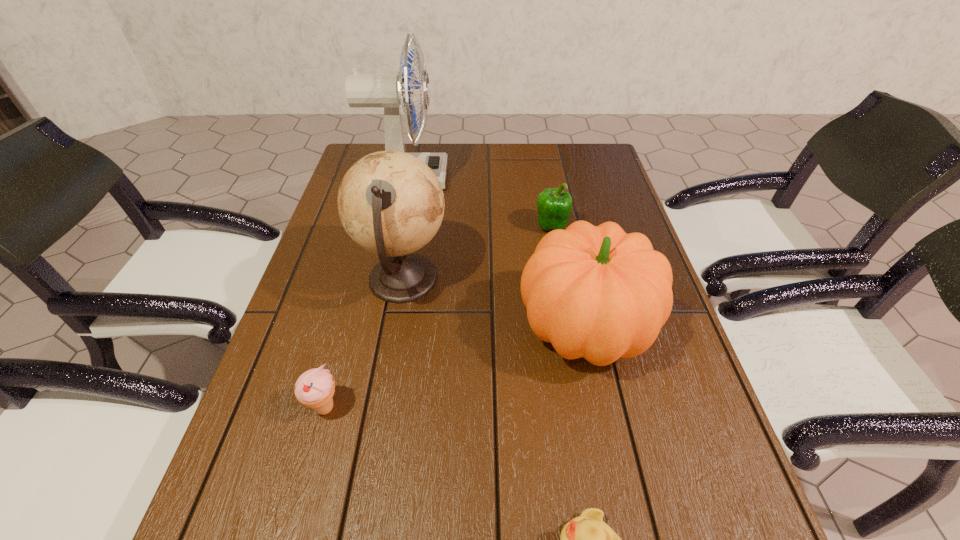
Where is `vacant space at the left edge`? The height and width of the screenshot is (540, 960). vacant space at the left edge is located at coordinates (336, 259).

Identify the location of vacant space at the right edge of the desktop. This screenshot has width=960, height=540. (586, 206).

In the image, there is a desktop. Where is `blank space at the near left corner`? blank space at the near left corner is located at coordinates (223, 535).

The image size is (960, 540). What are the coordinates of `free area in between the third tallest object and the globe` in the screenshot? It's located at (494, 305).

Identify the location of free space between the farthest object and the third tallest object. (496, 254).

Locate an element on the screen. The image size is (960, 540). vacant space in between the tallest object and the pumpkin is located at coordinates (496, 254).

Identify the location of vacant region between the pumpkin and the globe. This screenshot has height=540, width=960. (494, 305).

Locate an element on the screen. blank region between the icecream and the tallest object is located at coordinates (366, 293).

Where is `vacant space in between the fan and the second shortest object`? vacant space in between the fan and the second shortest object is located at coordinates (366, 293).

Locate an element on the screen. This screenshot has height=540, width=960. the closest object to the nearest object is located at coordinates (595, 292).